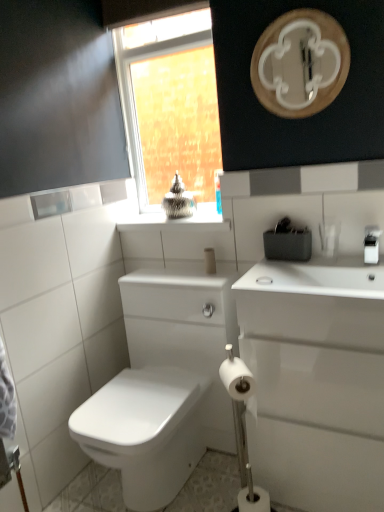
Where is `free location in front of white matte cylindrical container at center`? free location in front of white matte cylindrical container at center is located at coordinates (209, 280).